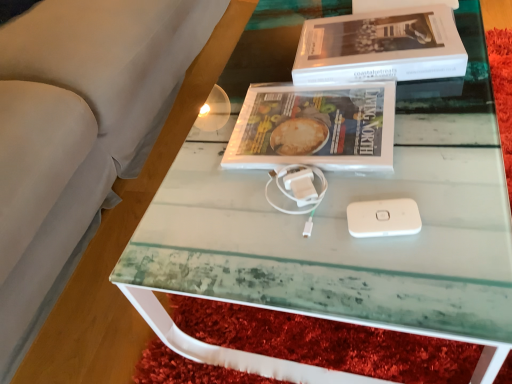
The width and height of the screenshot is (512, 384). Describe the element at coordinates (315, 127) in the screenshot. I see `matte plastic magazine at center` at that location.

Where is `matte plastic magazine at center`? This screenshot has width=512, height=384. matte plastic magazine at center is located at coordinates (315, 127).

Image resolution: width=512 pixels, height=384 pixels. In order to click on white matte book at upper center in this screenshot , I will do `click(380, 47)`.

This screenshot has width=512, height=384. What do you see at coordinates (380, 47) in the screenshot?
I see `white matte book at upper center` at bounding box center [380, 47].

This screenshot has width=512, height=384. What are the coordinates of `matte plastic magazine at center` in the screenshot? It's located at (315, 127).

In the image, is matte plastic magazine at center on the left side or the right side of white matte book at upper center?

matte plastic magazine at center is positioned on white matte book at upper center's left side.

Which is behind, matte plastic magazine at center or white matte book at upper center?

white matte book at upper center.

Which is farther from the camera, (362, 139) or (430, 24)?

Point (430, 24)

From the image's perspective, is matte plastic magazine at center on top of white matte book at upper center?

No, from the image's perspective, matte plastic magazine at center is not above white matte book at upper center.

From a real-world perspective, between matte plastic magazine at center and white matte book at upper center, who is vertically lower?

In real-world perspective, matte plastic magazine at center is lower.

Considering the sizes of objects matte plastic magazine at center and white matte book at upper center in the image provided, who is wider, matte plastic magazine at center or white matte book at upper center?

With larger width is white matte book at upper center.

In terms of height, does matte plastic magazine at center look taller or shorter compared to white matte book at upper center?

matte plastic magazine at center is shorter than white matte book at upper center.

Considering the sizes of objects matte plastic magazine at center and white matte book at upper center in the image provided, who is bigger, matte plastic magazine at center or white matte book at upper center?

With larger size is white matte book at upper center.

Is matte plastic magazine at center inside or outside of white matte book at upper center?

matte plastic magazine at center is not enclosed by white matte book at upper center.

Is matte plastic magazine at center next to white matte book at upper center and touching it?

No, matte plastic magazine at center is not in contact with white matte book at upper center.

From the picture: Is matte plastic magazine at center aimed at white matte book at upper center?

No, matte plastic magazine at center is not oriented towards white matte book at upper center.

The width and height of the screenshot is (512, 384). I want to click on book below the white matte book at upper center (from a real-world perspective), so click(315, 127).

Which object is positioned more to the left, white matte book at upper center or matte plastic magazine at center?

matte plastic magazine at center.

Which object is closer to the camera taking this photo, white matte book at upper center or matte plastic magazine at center?

matte plastic magazine at center is more forward.

Is point (403, 71) in front of point (393, 107)?

No, it is behind (393, 107).

From the image's perspective, which one is positioned lower, white matte book at upper center or matte plastic magazine at center?

matte plastic magazine at center appears lower in the image.

From a real-world perspective, is white matte book at upper center under matte plastic magazine at center?

No.

Between white matte book at upper center and matte plastic magazine at center, which one has larger width?

With larger width is white matte book at upper center.

Considering the relative sizes of white matte book at upper center and matte plastic magazine at center in the image provided, is white matte book at upper center shorter than matte plastic magazine at center?

In fact, white matte book at upper center may be taller than matte plastic magazine at center.

Looking at this image, looking at the image, does white matte book at upper center seem bigger or smaller compared to matte plastic magazine at center?

white matte book at upper center is bigger than matte plastic magazine at center.

Choose the correct answer: Is white matte book at upper center inside matte plastic magazine at center or outside it?

white matte book at upper center exists outside the volume of matte plastic magazine at center.

Is white matte book at upper center with matte plastic magazine at center?

They are not placed beside each other.

Is white matte book at upper center aimed at matte plastic magazine at center?

No, white matte book at upper center is not aimed at matte plastic magazine at center.

Measure the distance between white matte book at upper center and matte plastic magazine at center.

They are 5.26 inches apart.

Identify the location of box that appears above the matte plastic magazine at center (from the image's perspective). Image resolution: width=512 pixels, height=384 pixels. (380, 47).

Locate an element on the screen. This screenshot has height=384, width=512. box located behind the matte plastic magazine at center is located at coordinates (380, 47).

The image size is (512, 384). Identify the location of box to the right of matte plastic magazine at center. (380, 47).